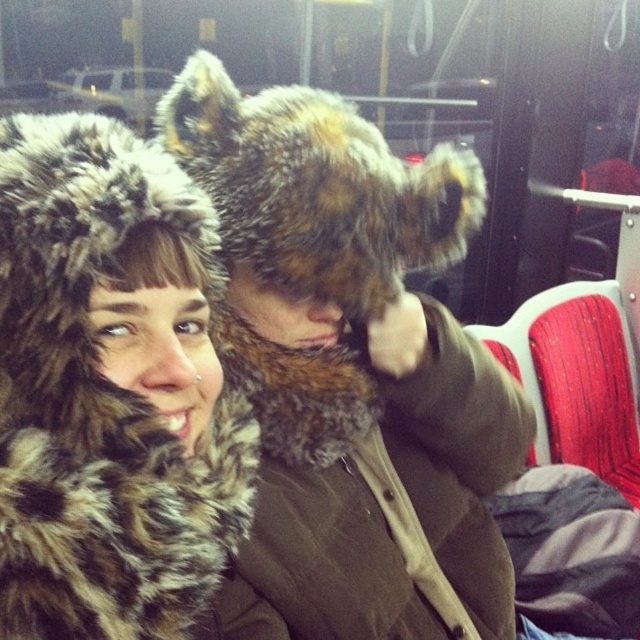
You are a passenger on a crowded bus and need to place a 6.5 inch wide book between the fuzzy brown fur hat at center and the fuzzy fur hat at upper left. Can the book fit without touching either hat?

The distance between the fuzzy brown fur hat at center and the fuzzy fur hat at upper left is 7.50 inches. Since the book is 6.5 inches wide, it can fit between them as there is enough space.

You are a photographer trying to capture both hats in a single shot. Given that your camera can only focus on objects up to 1 meter tall, will both the fuzzy brown fur hat at center and the fuzzy fur hat at upper left fit within the focus range?

The fuzzy brown fur hat at center is taller than the fuzzy fur hat at upper left. Since the camera can focus on objects up to 1 meter tall, both hats will fit within the focus range as long as their individual heights do not exceed 1 meter. However, without specific measurements, we can only confirm that the taller hat is the fuzzy brown fur hat at center.